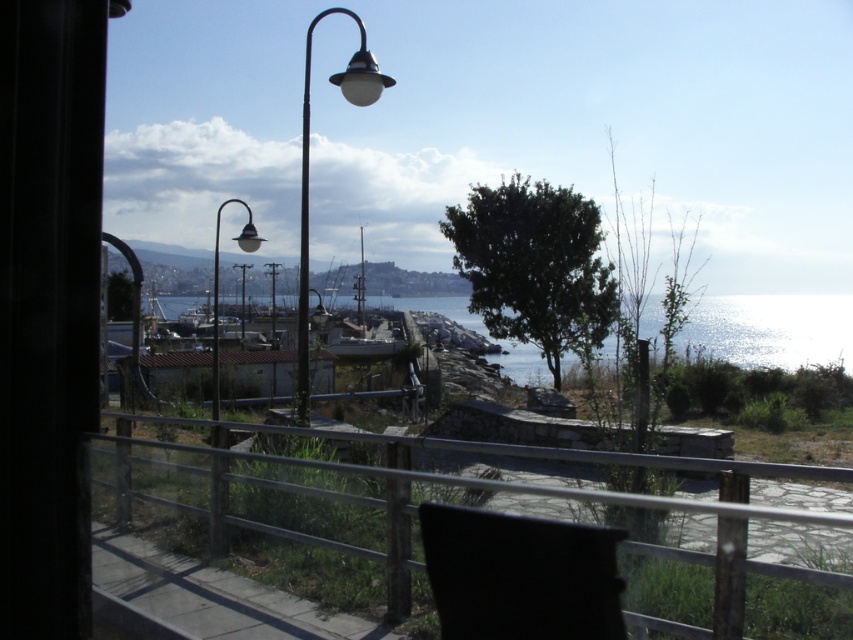
You are standing on the balcony and want to walk down to the waterfront. There are two metallic streetlights ahead. Which one is closer to the waterfront, the metallic streetlamp at center or the metallic street light at left?

The metallic streetlamp at center is positioned over the metallic street light at left, so the metallic street light at left is closer to the waterfront.

In the scene shown: You are sitting on the black plastic chair at lower center and want to see the metallic gray ship at center. Is the ship visible from your current position?

The black plastic chair at lower center is not as tall as metallic gray ship at center, so yes, the ship is visible from the chair.